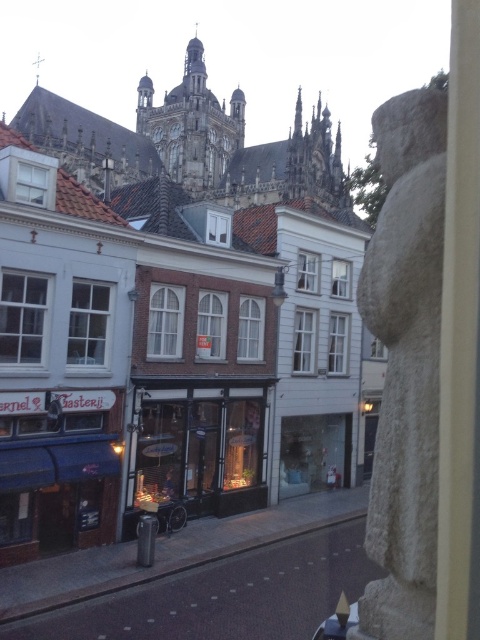
Between white brick building at center and matte glass storefront at center, which one appears on the left side from the viewer's perspective?

From the viewer's perspective, white brick building at center appears more on the left side.

Between white brick building at center and matte glass storefront at center, which one appears on the right side from the viewer's perspective?

matte glass storefront at center is more to the right.

I want to click on white brick building at center, so click(173, 316).

Identify the location of white stone statue at right. (406, 364).

Describe the element at coordinates (406, 364) in the screenshot. Image resolution: width=480 pixels, height=640 pixels. I see `white stone statue at right` at that location.

Find the location of a particular element. Image resolution: width=480 pixels, height=640 pixels. white stone statue at right is located at coordinates (406, 364).

Who is taller, white brick building at center or white stone statue at right?

white brick building at center

Who is lower down, white brick building at center or white stone statue at right?

white stone statue at right is below.

Who is more forward, (200, 193) or (440, 120)?

Point (440, 120) is more forward.

At what (x,y) coordinates should I click in order to perform the action: click on white brick building at center. Please return your answer as a coordinate pair (x, y). Looking at the image, I should click on (173, 316).